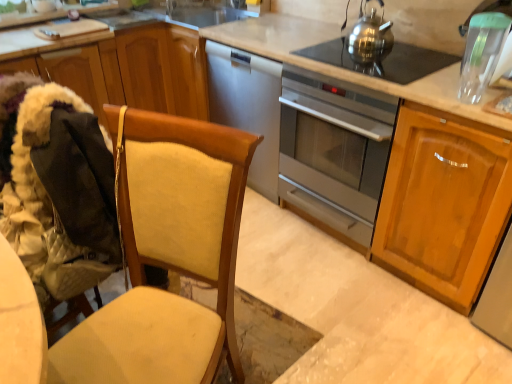
Question: Could you tell me if beige fabric folding chair at left is facing satin silver oven at center?

Choices:
 (A) yes
 (B) no

Answer: (B)

Question: Is beige fabric folding chair at left closer to camera compared to satin silver oven at center?

Choices:
 (A) no
 (B) yes

Answer: (B)

Question: From the image's perspective, would you say beige fabric folding chair at left is shown under satin silver oven at center?

Choices:
 (A) no
 (B) yes

Answer: (B)

Question: Considering the relative sizes of beige fabric folding chair at left and satin silver oven at center in the image provided, is beige fabric folding chair at left shorter than satin silver oven at center?

Choices:
 (A) yes
 (B) no

Answer: (A)

Question: Is beige fabric folding chair at left looking in the opposite direction of satin silver oven at center?

Choices:
 (A) yes
 (B) no

Answer: (A)

Question: Choose the correct answer: Is polished stainless steel gas stove at upper center inside transparent plastic container at upper right or outside it?

Choices:
 (A) outside
 (B) inside

Answer: (A)

Question: Is polished stainless steel gas stove at upper center bigger or smaller than transparent plastic container at upper right?

Choices:
 (A) small
 (B) big

Answer: (B)

Question: From their relative heights in the image, would you say polished stainless steel gas stove at upper center is taller or shorter than transparent plastic container at upper right?

Choices:
 (A) short
 (B) tall

Answer: (A)

Question: Considering the positions of point (377, 66) and point (489, 23), is point (377, 66) closer or farther from the camera than point (489, 23)?

Choices:
 (A) farther
 (B) closer

Answer: (A)

Question: From a real-world perspective, is satin silver oven at center above or below light brown wood cabinet at right, placed as the 2th cabinetry when sorted from left to right?

Choices:
 (A) above
 (B) below

Answer: (B)

Question: Does point click(x=355, y=223) appear closer or farther from the camera than point click(x=499, y=152)?

Choices:
 (A) farther
 (B) closer

Answer: (A)

Question: From their relative heights in the image, would you say satin silver oven at center is taller or shorter than light brown wood cabinet at right, which is the 1th cabinetry in right-to-left order?

Choices:
 (A) short
 (B) tall

Answer: (B)

Question: Is satin silver oven at center spatially inside light brown wood cabinet at right, which is the 1th cabinetry in right-to-left order, or outside of it?

Choices:
 (A) inside
 (B) outside

Answer: (B)

Question: From a real-world perspective, relative to polished stainless steel gas stove at upper center, is beige fabric folding chair at left vertically above or below?

Choices:
 (A) below
 (B) above

Answer: (A)

Question: Looking at their shapes, would you say beige fabric folding chair at left is wider or thinner than polished stainless steel gas stove at upper center?

Choices:
 (A) wide
 (B) thin

Answer: (B)